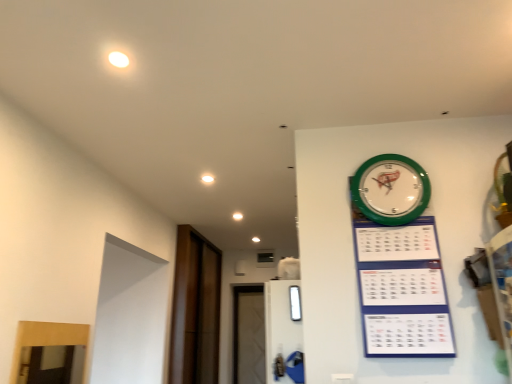
The height and width of the screenshot is (384, 512). What are the coordinates of `transparent glass window at center` in the screenshot? It's located at (295, 303).

What is the approximate width of transparent glass window at center?

The width of transparent glass window at center is 1.62 inches.

Image resolution: width=512 pixels, height=384 pixels. Identify the location of green plastic calendar at upper right. (402, 290).

From the image's perspective, is transparent glass window at center above or below green plastic wall clock at upper right?

Based on their image positions, transparent glass window at center is located beneath green plastic wall clock at upper right.

Could you tell me if transparent glass window at center is turned towards green plastic wall clock at upper right?

No.

Is green plastic wall clock at upper right directly adjacent to green plastic calendar at upper right?

green plastic wall clock at upper right and green plastic calendar at upper right are clearly separated.

Is green plastic wall clock at upper right surrounding green plastic calendar at upper right?

No.

Could you tell me if green plastic wall clock at upper right is turned towards green plastic calendar at upper right?

Yes, green plastic wall clock at upper right is oriented towards green plastic calendar at upper right.

Does green plastic wall clock at upper right have a greater height compared to green plastic calendar at upper right?

No.

Would you say transparent glass window at center is a long distance from brown wood door at left?

transparent glass window at center is far away from brown wood door at left.

Is brown wood door at left a part of transparent glass window at center?

No, transparent glass window at center does not contain brown wood door at left.

In terms of height, does transparent glass window at center look taller or shorter compared to brown wood door at left?

In the image, transparent glass window at center appears to be shorter than brown wood door at left.

Which of these two, green plastic calendar at upper right or white glossy light at upper center, is smaller?

With smaller size is white glossy light at upper center.

From a real-world perspective, between green plastic calendar at upper right and white glossy light at upper center, who is vertically lower?

green plastic calendar at upper right, from a real-world perspective.

Would you say green plastic calendar at upper right is outside white glossy light at upper center?

Yes, green plastic calendar at upper right is located beyond the bounds of white glossy light at upper center.

How distant is green plastic calendar at upper right from transparent glass window at center?

green plastic calendar at upper right and transparent glass window at center are 21.54 inches apart from each other.

Are green plastic calendar at upper right and transparent glass window at center located far from each other?

That's not correct — green plastic calendar at upper right is a little close to transparent glass window at center.

Find the location of a particular element. The height and width of the screenshot is (384, 512). bulletin board in front of the transparent glass window at center is located at coordinates (402, 290).

Which object is closer to the camera taking this photo, green plastic calendar at upper right or transparent glass window at center?

green plastic calendar at upper right is closer to the camera.

From the picture: Is green plastic wall clock at upper right taller or shorter than brown wood door at left?

Clearly, green plastic wall clock at upper right is shorter compared to brown wood door at left.

Image resolution: width=512 pixels, height=384 pixels. Find the location of `wall clock above the brown wood door at left (from the image's perspective)`. wall clock above the brown wood door at left (from the image's perspective) is located at coordinates (390, 189).

From the image's perspective, would you say brown wood door at left is shown under white glossy light at upper center?

Indeed, from the image's perspective, brown wood door at left is shown beneath white glossy light at upper center.

Is brown wood door at left spatially inside white glossy light at upper center, or outside of it?

brown wood door at left is located beyond the bounds of white glossy light at upper center.

Can you tell me how much brown wood door at left and white glossy light at upper center differ in facing direction?

They differ by 90.7 degrees in their facing directions.

Locate an element on the screen. The height and width of the screenshot is (384, 512). wall clock in front of the transparent glass window at center is located at coordinates (390, 189).

This screenshot has width=512, height=384. I want to click on wall clock behind the green plastic calendar at upper right, so click(x=390, y=189).

Looking at this image, from the image, which object appears to be nearer to green plastic calendar at upper right, white glossy light at upper center or brown wood door at left?

Based on the image, white glossy light at upper center appears to be nearer to green plastic calendar at upper right.

Estimate the real-world distances between objects in this image. Which object is closer to green plastic calendar at upper right, transparent glass window at center or white glossy light at upper center?

transparent glass window at center.

Estimate the real-world distances between objects in this image. Which object is closer to green plastic calendar at upper right, white glossy light at upper center or green plastic wall clock at upper right?

Based on the image, green plastic wall clock at upper right appears to be nearer to green plastic calendar at upper right.

Considering their positions, is white glossy light at upper center positioned closer to transparent glass window at center than brown wood door at left?

Based on the image, white glossy light at upper center appears to be nearer to transparent glass window at center.

Considering their positions, is green plastic wall clock at upper right positioned further to green plastic calendar at upper right than white glossy light at upper center?

white glossy light at upper center is further to green plastic calendar at upper right.

Which object lies nearer to the anchor point green plastic calendar at upper right, green plastic wall clock at upper right or brown wood door at left?

green plastic wall clock at upper right lies closer to green plastic calendar at upper right than the other object.

When comparing their distances from white glossy light at upper center, does green plastic wall clock at upper right or green plastic calendar at upper right seem further?

green plastic calendar at upper right.

Looking at this image, which object lies further to the anchor point transparent glass window at center, brown wood door at left or green plastic wall clock at upper right?

Based on the image, brown wood door at left appears to be further to transparent glass window at center.

The width and height of the screenshot is (512, 384). I want to click on window between white glossy light at upper center and green plastic wall clock at upper right, so click(x=295, y=303).

Where is `window positioned between green plastic calendar at upper right and white glossy light at upper center from near to far`? The width and height of the screenshot is (512, 384). window positioned between green plastic calendar at upper right and white glossy light at upper center from near to far is located at coordinates (295, 303).

This screenshot has width=512, height=384. In order to click on bulletin board between green plastic wall clock at upper right and transparent glass window at center vertically in this screenshot , I will do `click(402, 290)`.

In order to click on light positioned between green plastic calendar at upper right and brown wood door at left from near to far in this screenshot , I will do `click(207, 178)`.